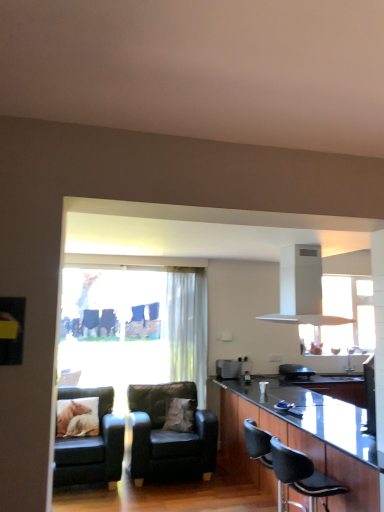
This screenshot has height=512, width=384. Describe the element at coordinates (77, 417) in the screenshot. I see `light brown fabric pillow at lower left, which appears as the 1th pillow when viewed from the left` at that location.

Locate an element on the screen. The width and height of the screenshot is (384, 512). light brown fabric pillow at lower left, the second pillow in the right-to-left sequence is located at coordinates (77, 417).

At what (x,y) coordinates should I click in order to perform the action: click on translucent fabric curtain at center. Please return your answer as a coordinate pair (x, y). This screenshot has width=384, height=512. Looking at the image, I should click on (188, 327).

This screenshot has height=512, width=384. What do you see at coordinates (169, 435) in the screenshot? I see `black leather chair at center, which is the third chair in front-to-back order` at bounding box center [169, 435].

Find the location of a particular element. Image resolution: width=384 pixels, height=512 pixels. black leather chair at center, marked as the 2th chair in a right-to-left arrangement is located at coordinates (169, 435).

Where is `white soft pillow at center, the 1th pillow in the right-to-left sequence`? The width and height of the screenshot is (384, 512). white soft pillow at center, the 1th pillow in the right-to-left sequence is located at coordinates (180, 415).

Where is `black leather chair at lower right, which is counted as the 1th chair, starting from the right`? The width and height of the screenshot is (384, 512). black leather chair at lower right, which is counted as the 1th chair, starting from the right is located at coordinates (302, 474).

Where is `light brown fabric pillow at lower left, which appears as the 1th pillow when viewed from the left`? The width and height of the screenshot is (384, 512). light brown fabric pillow at lower left, which appears as the 1th pillow when viewed from the left is located at coordinates (77, 417).

Is leather couch at lower left, acting as the 3th chair starting from the right, bigger or smaller than light brown fabric pillow at lower left, the second pillow in the right-to-left sequence?

Clearly, leather couch at lower left, acting as the 3th chair starting from the right, is larger in size than light brown fabric pillow at lower left, the second pillow in the right-to-left sequence.

Can we say leather couch at lower left, which ranks as the second chair in front-to-back order, lies outside light brown fabric pillow at lower left, the second pillow in the right-to-left sequence?

Yes.

Does leather couch at lower left, acting as the 3th chair starting from the right, appear on the right side of light brown fabric pillow at lower left, the second pillow in the right-to-left sequence?

Yes.

What are the coordinates of `chair that is the 1st one when counting downward from the light brown fabric pillow at lower left, which appears as the 1th pillow when viewed from the left (from the image's perspective)` in the screenshot? It's located at (91, 445).

Considering the sizes of objects light brown fabric pillow at lower left, which appears as the 1th pillow when viewed from the left, and leather couch at lower left, which ranks as the 2th chair in back-to-front order, in the image provided, who is taller, light brown fabric pillow at lower left, which appears as the 1th pillow when viewed from the left, or leather couch at lower left, which ranks as the 2th chair in back-to-front order,?

leather couch at lower left, which ranks as the 2th chair in back-to-front order.

Does light brown fabric pillow at lower left, the second pillow in the right-to-left sequence, appear on the right side of leather couch at lower left, which ranks as the 2th chair in back-to-front order?

No.

Is light brown fabric pillow at lower left, which appears as the 1th pillow when viewed from the left, inside the boundaries of leather couch at lower left, which ranks as the second chair in front-to-back order, or outside?

light brown fabric pillow at lower left, which appears as the 1th pillow when viewed from the left, is spatially positioned inside leather couch at lower left, which ranks as the second chair in front-to-back order.

Which object is wider, light brown fabric pillow at lower left, the second pillow in the right-to-left sequence, or leather couch at lower left, which ranks as the second chair in front-to-back order?

Wider between the two is leather couch at lower left, which ranks as the second chair in front-to-back order.

Is point (331, 477) more distant than point (201, 270)?

No, (331, 477) is in front of (201, 270).

Is black leather chair at lower right, the 3th chair from the left, closer to camera compared to translucent fabric curtain at center?

Yes.

Can you tell me how much black leather chair at lower right, which is counted as the 1th chair, starting from the right, and translucent fabric curtain at center differ in facing direction?

The angle between the facing direction of black leather chair at lower right, which is counted as the 1th chair, starting from the right, and the facing direction of translucent fabric curtain at center is 83.2 degrees.

Who is shorter, light brown fabric pillow at lower left, which appears as the 1th pillow when viewed from the left, or translucent fabric curtain at center?

Standing shorter between the two is light brown fabric pillow at lower left, which appears as the 1th pillow when viewed from the left.

Between light brown fabric pillow at lower left, the second pillow in the right-to-left sequence, and translucent fabric curtain at center, which one has larger width?

With larger width is light brown fabric pillow at lower left, the second pillow in the right-to-left sequence.

Who is bigger, light brown fabric pillow at lower left, which appears as the 1th pillow when viewed from the left, or translucent fabric curtain at center?

With larger size is translucent fabric curtain at center.

In the scene shown: How many degrees apart are the facing directions of light brown fabric pillow at lower left, the second pillow in the right-to-left sequence, and translucent fabric curtain at center?

The angular difference between light brown fabric pillow at lower left, the second pillow in the right-to-left sequence, and translucent fabric curtain at center is 4.34 degrees.

Is white matte exhaust hood at upper center located outside black glossy countertop at center?

Indeed, white matte exhaust hood at upper center is completely outside black glossy countertop at center.

From their relative heights in the image, would you say white matte exhaust hood at upper center is taller or shorter than black glossy countertop at center?

Clearly, white matte exhaust hood at upper center is shorter compared to black glossy countertop at center.

Considering the relative sizes of white matte exhaust hood at upper center and black glossy countertop at center in the image provided, is white matte exhaust hood at upper center bigger than black glossy countertop at center?

Actually, white matte exhaust hood at upper center might be smaller than black glossy countertop at center.

Considering the relative sizes of white matte exhaust hood at upper center and translucent fabric curtain at center in the image provided, is white matte exhaust hood at upper center shorter than translucent fabric curtain at center?

Yes, white matte exhaust hood at upper center is shorter than translucent fabric curtain at center.

Find the location of a particular element. The image size is (384, 512). exhaust hood located above the translucent fabric curtain at center (from the image's perspective) is located at coordinates (302, 288).

Would you say white matte exhaust hood at upper center is outside translucent fabric curtain at center?

Yes, white matte exhaust hood at upper center is not within translucent fabric curtain at center.

Is leather couch at lower left, which ranks as the second chair in front-to-back order, in front of or behind translucent fabric curtain at center in the image?

leather couch at lower left, which ranks as the second chair in front-to-back order, is in front of translucent fabric curtain at center.

I want to click on chair that is the 2nd one when counting leftward from the translucent fabric curtain at center, so click(91, 445).

Considering the relative sizes of leather couch at lower left, positioned as the first chair in left-to-right order, and translucent fabric curtain at center in the image provided, is leather couch at lower left, positioned as the first chair in left-to-right order, smaller than translucent fabric curtain at center?

No.

Is leather couch at lower left, positioned as the first chair in left-to-right order, directly adjacent to translucent fabric curtain at center?

leather couch at lower left, positioned as the first chair in left-to-right order, is not next to translucent fabric curtain at center, and they're not touching.

Starting from the light brown fabric pillow at lower left, the second pillow in the right-to-left sequence, which chair is the 2nd one in front? Please provide its 2D coordinates.

[(91, 445)]

Where is `chair that is the 1st object located below the light brown fabric pillow at lower left, the second pillow in the right-to-left sequence (from the image's perspective)`? The image size is (384, 512). chair that is the 1st object located below the light brown fabric pillow at lower left, the second pillow in the right-to-left sequence (from the image's perspective) is located at coordinates (91, 445).

Based on their spatial positions, is black leather chair at center, marked as the 2th chair in a right-to-left arrangement, or translucent fabric curtain at center closer to black leather armchair at lower center?

black leather chair at center, marked as the 2th chair in a right-to-left arrangement, is closer to black leather armchair at lower center.

From the image, which object appears to be farther from black glossy countertop at center, black leather armchair at lower center or white matte exhaust hood at upper center?

Among the two, white matte exhaust hood at upper center is located further to black glossy countertop at center.

When comparing their distances from white soft pillow at center, marked as the 2th pillow in a left-to-right arrangement, does translucent fabric curtain at center or black leather armchair at lower center seem closer?

Based on the image, black leather armchair at lower center appears to be nearer to white soft pillow at center, marked as the 2th pillow in a left-to-right arrangement.

Estimate the real-world distances between objects in this image. Which object is further from light brown fabric pillow at lower left, the second pillow in the right-to-left sequence, black leather armchair at lower center or leather couch at lower left, which ranks as the 2th chair in back-to-front order?

black leather armchair at lower center is positioned further to the anchor light brown fabric pillow at lower left, the second pillow in the right-to-left sequence.

Looking at the image, which one is located closer to black glossy countertop at center, white matte exhaust hood at upper center or translucent fabric curtain at center?

Based on the image, white matte exhaust hood at upper center appears to be nearer to black glossy countertop at center.

Which object lies nearer to the anchor point black leather chair at lower right, which is counted as the 1th chair, starting from the right, white matte exhaust hood at upper center or black leather chair at center, which is the third chair in front-to-back order?

Based on the image, black leather chair at center, which is the third chair in front-to-back order, appears to be nearer to black leather chair at lower right, which is counted as the 1th chair, starting from the right.

Based on their spatial positions, is black glossy countertop at center or white soft pillow at center, marked as the 2th pillow in a left-to-right arrangement, further from white matte exhaust hood at upper center?

white soft pillow at center, marked as the 2th pillow in a left-to-right arrangement, is further to white matte exhaust hood at upper center.

Based on their spatial positions, is translucent fabric curtain at center or black leather chair at center, which is the third chair in front-to-back order, further from black leather armchair at lower center?

translucent fabric curtain at center lies further to black leather armchair at lower center than the other object.

You are a GUI agent. You are given a task and a screenshot of the screen. Output one action in this format:
    pyautogui.click(x=<x>, y=<y>)
    Task: Click on the exhaust hood between black glossy countertop at center and translucent fabric curtain at center from front to back
    
    Given the screenshot: What is the action you would take?
    pyautogui.click(x=302, y=288)

Identify the location of armchair between black leather chair at lower right, the 3th chair from the left, and white soft pillow at center, the 1th pillow in the right-to-left sequence, in the front-back direction. [x=283, y=465].

I want to click on pillow between leather couch at lower left, positioned as the first chair in left-to-right order, and black leather armchair at lower center, so click(180, 415).

This screenshot has width=384, height=512. What are the coordinates of `chair between white matte exhaust hood at upper center and black leather armchair at lower center in the vertical direction` in the screenshot? It's located at (302, 474).